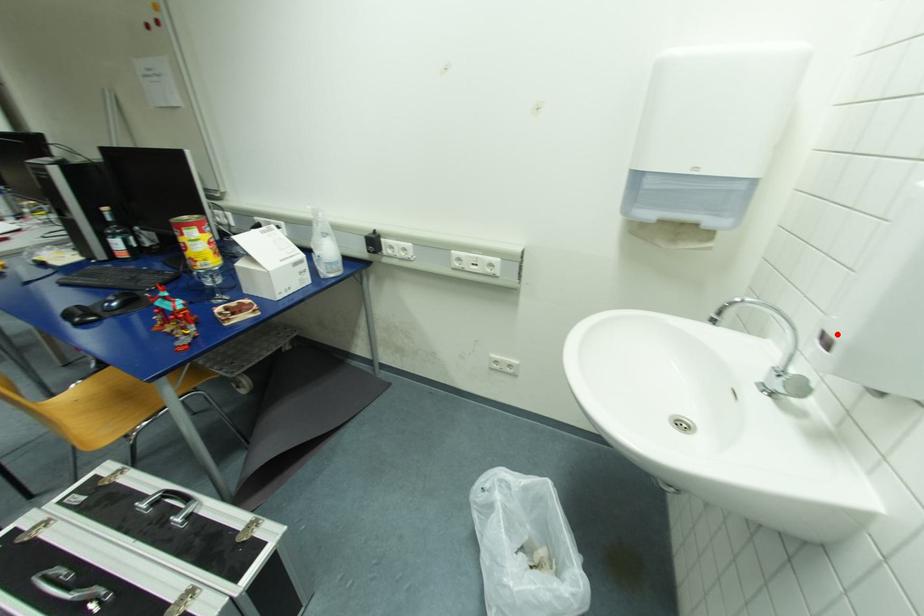
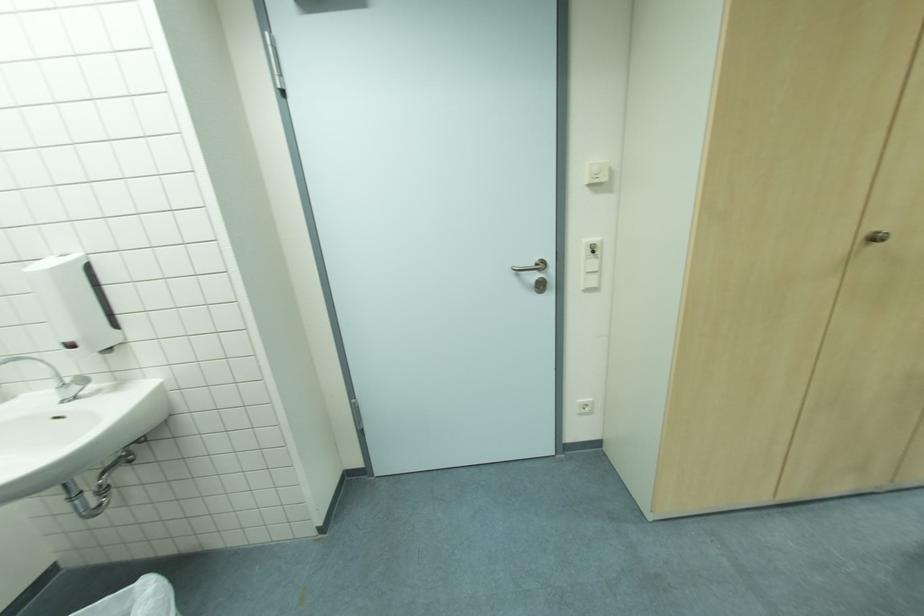
Where in the second image is the point corresponding to the highlighted location from the first image?

(71, 341)